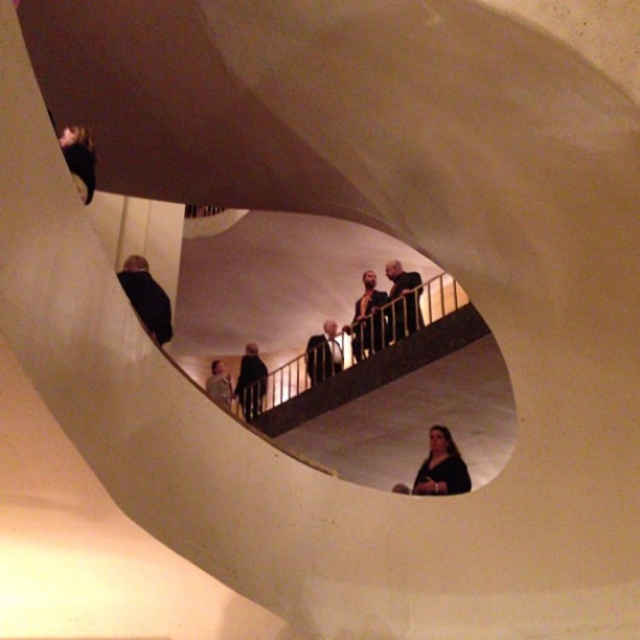
You are attending a formal event and need to choose an outfit that allows more space for movement. Based on the image, which of the following would you select between the black matte jacket at center and the dark gray suit at center?

The black matte jacket at center is thinner than the dark gray suit at center, so it would allow more space for movement.

You are standing at the entrance of the curved white tunnel structure and want to reach the point labeled as point (308, 362). There is another point labeled point (241, 401) further along the tunnel. Which point should you aim for first to reach your destination?

You should aim for point (308, 362) first because it is closer to your starting position at the entrance. Point (241, 401) is behind point (308, 362), meaning it is further away from the entrance.

You are attending a formal event and notice two jackets in the scene. The black matte jacket at lower left and the light brown leather jacket at center. Which jacket is positioned higher in the image?

The black matte jacket at lower left is positioned higher than the light brown leather jacket at center.